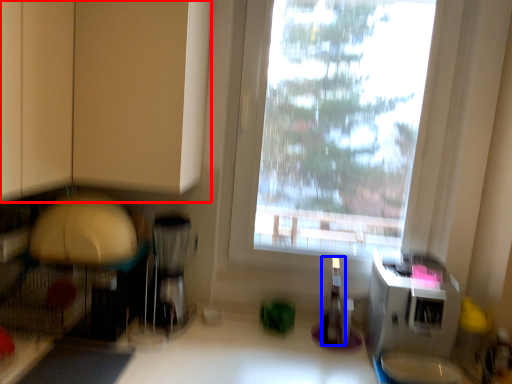
Question: Which object appears closest to the camera in this image, cabinetry (highlighted by a red box) or bottle (highlighted by a blue box)?

Choices:
 (A) cabinetry
 (B) bottle

Answer: (A)